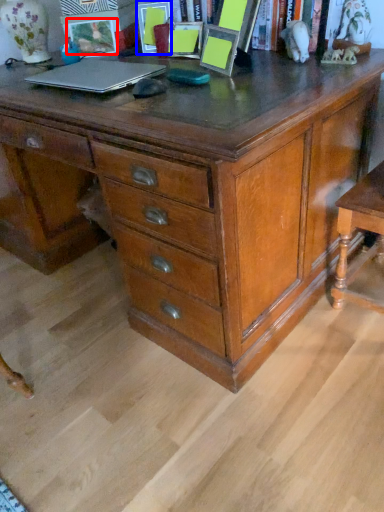
Question: Which of the following is the closest to the observer, picture frame (highlighted by a red box) or picture frame (highlighted by a blue box)?

Choices:
 (A) picture frame
 (B) picture frame

Answer: (B)